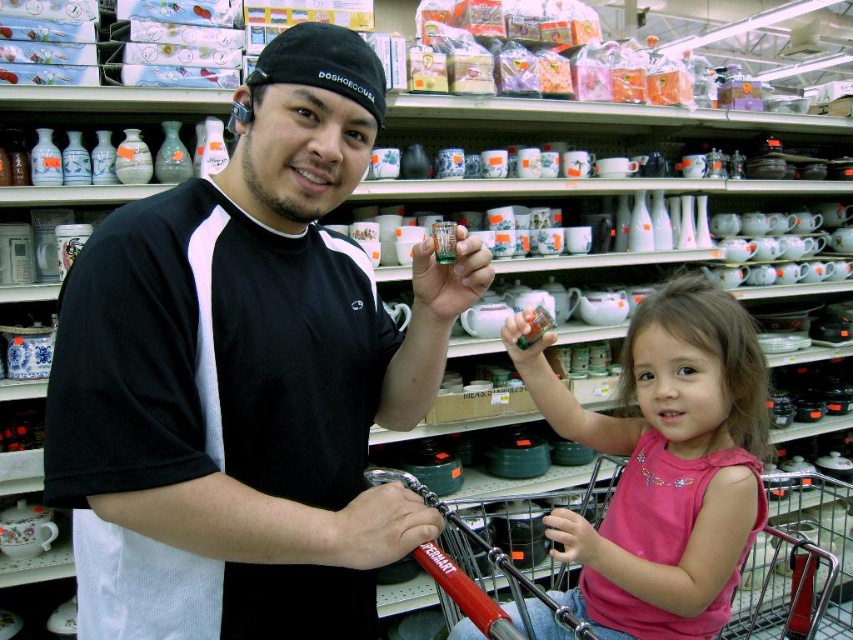
You are standing in the retail store and want to know which of the two points, point (163, 451) or point (469, 556), is closer to you. Can you determine this based on the scene?

Point (163, 451) is closer to the camera than point (469, 556), so it is closer to you.

You are a customer in the store and want to ask the person in the pink fabric shirt at center a question. Which direction should you walk to approach them from the black matte shirt at center?

The black matte shirt at center is closer to the viewer than the pink fabric shirt at center, so you should walk forward towards the pink fabric shirt at center to approach them.

You are a store employee who needs to place a new item on the shelf. You see the black matte shirt at center and the metallic red shopping cart at lower center. Which object is positioned higher in the image?

The black matte shirt at center is above the metallic red shopping cart at lower center, so it is positioned higher in the image.